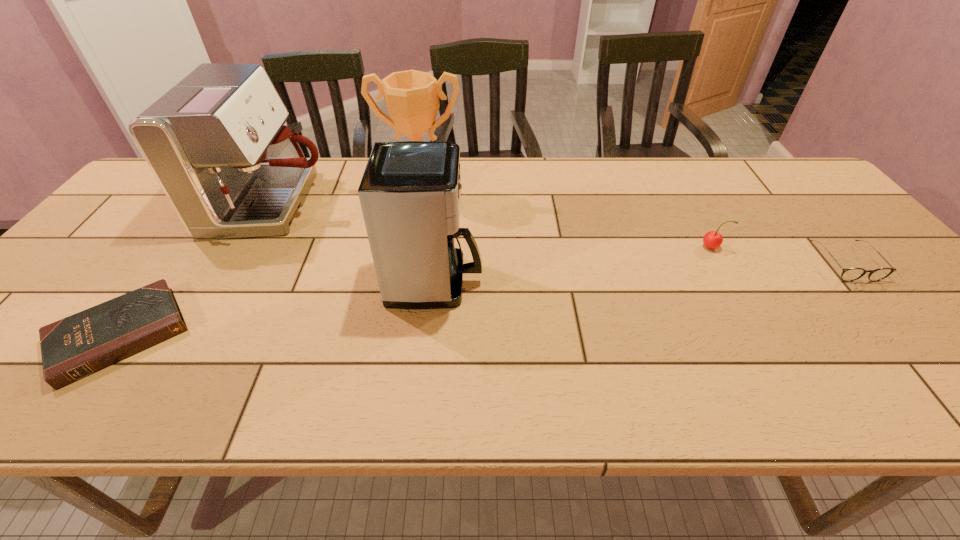
This screenshot has height=540, width=960. Identify the location of vacant space at the far edge. (746, 174).

In the image, there is a desktop. Identify the location of free space at the near edge. This screenshot has width=960, height=540. (118, 382).

Locate an element on the screen. The image size is (960, 540). vacant space at the left edge of the desktop is located at coordinates (35, 343).

Where is `blank area at the right edge`? blank area at the right edge is located at coordinates (821, 212).

Identify the location of free space that is in between the left coffee maker and the second object from right to left. This screenshot has width=960, height=540. (492, 225).

At what (x,y) coordinates should I click in order to perform the action: click on blank region between the rightmost object and the award. Please return your answer as a coordinate pair (x, y). The width and height of the screenshot is (960, 540). Looking at the image, I should click on (634, 230).

This screenshot has height=540, width=960. What are the coordinates of `unoccupied position between the award and the cherry` in the screenshot? It's located at (566, 221).

This screenshot has height=540, width=960. I want to click on free space between the award and the farther coffee maker, so click(x=347, y=200).

Find the location of a particular element. vacant space that is in between the third shortest object and the award is located at coordinates (566, 221).

Image resolution: width=960 pixels, height=540 pixels. I want to click on vacant space that is in between the award and the shortest object, so click(271, 266).